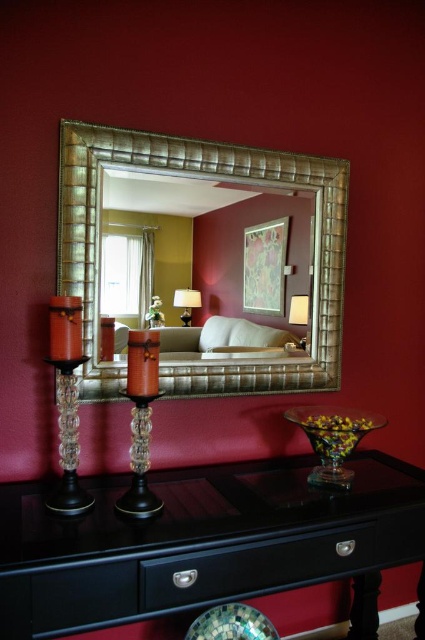
Does black glossy drawer at lower center have a lesser height compared to matte gold lampshade at upper right?

No, black glossy drawer at lower center is not shorter than matte gold lampshade at upper right.

Is black glossy drawer at lower center thinner than matte gold lampshade at upper right?

Incorrect, black glossy drawer at lower center's width is not less than matte gold lampshade at upper right's.

Describe the element at coordinates (255, 566) in the screenshot. I see `black glossy drawer at lower center` at that location.

What are the coordinates of `black glossy drawer at lower center` in the screenshot? It's located at (255, 566).

Who is more distant from viewer, (116, 572) or (367, 544)?

Positioned behind is point (367, 544).

Between black glossy vanity at lower center and black glossy drawer at lower center, which one has more height?

With more height is black glossy vanity at lower center.

Which is in front, point (204, 582) or point (238, 579)?

Point (204, 582) is more forward.

Locate an element on the screen. The image size is (425, 640). black glossy vanity at lower center is located at coordinates (201, 541).

Can you confirm if black wood drawer at lower center is positioned to the right of matte gold lampshade at upper right?

No, black wood drawer at lower center is not to the right of matte gold lampshade at upper right.

Does black wood drawer at lower center appear over matte gold lampshade at upper right?

Actually, black wood drawer at lower center is below matte gold lampshade at upper right.

The width and height of the screenshot is (425, 640). I want to click on black wood drawer at lower center, so click(x=82, y=595).